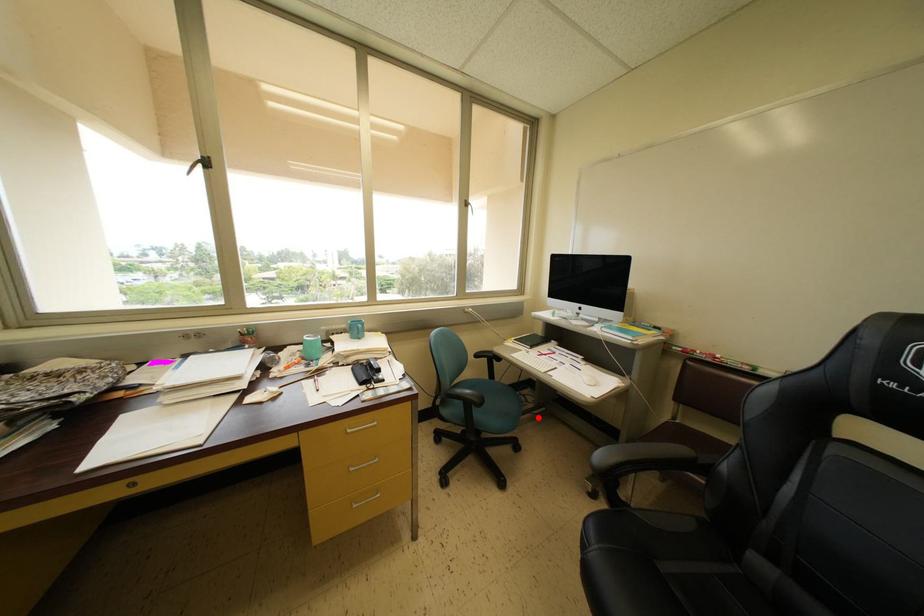
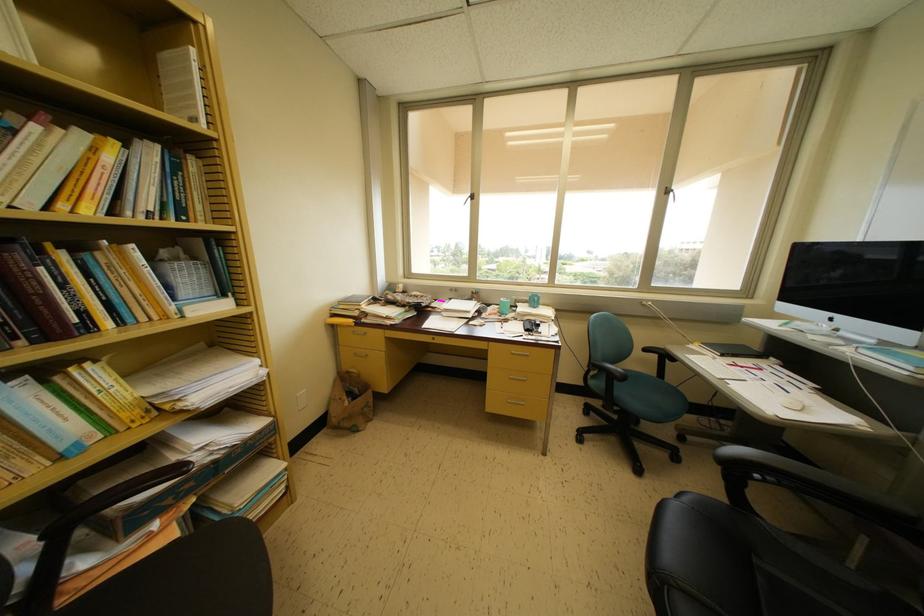
Where in the second image is the point corresponding to the highlighted location from the first image?

(730, 448)